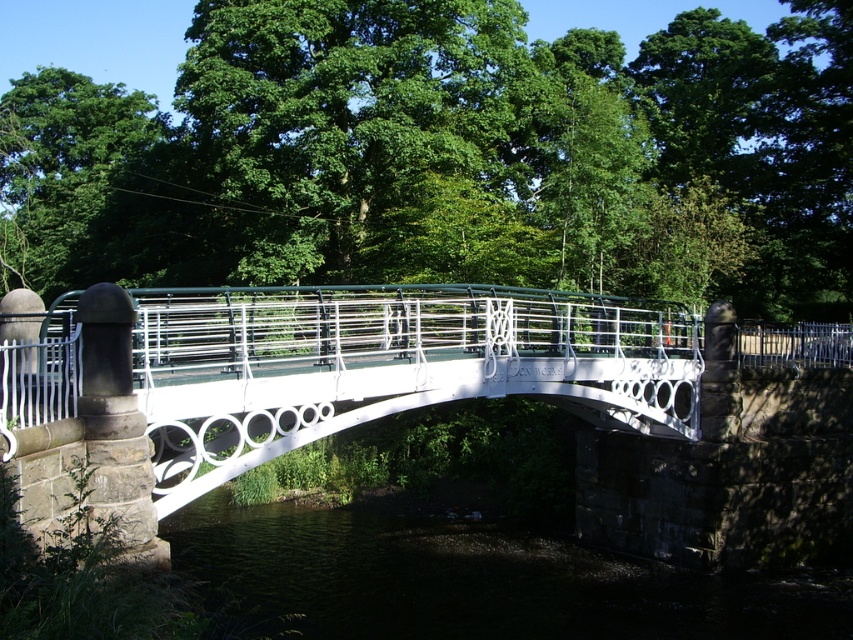
Question: Which point appears farthest from the camera in this image?

Choices:
 (A) (659, 636)
 (B) (259, 385)

Answer: (A)

Question: Which object appears closest to the camera in this image?

Choices:
 (A) dark water at lower center
 (B) white matte pedestrian bridge at center

Answer: (B)

Question: Can you confirm if white matte pedestrian bridge at center is positioned below dark water at lower center?

Choices:
 (A) no
 (B) yes

Answer: (A)

Question: Can you confirm if white matte pedestrian bridge at center is thinner than dark water at lower center?

Choices:
 (A) yes
 (B) no

Answer: (B)

Question: Which of the following is the closest to the observer?

Choices:
 (A) white matte pedestrian bridge at center
 (B) dark water at lower center

Answer: (A)

Question: Does white matte pedestrian bridge at center have a greater width compared to dark water at lower center?

Choices:
 (A) no
 (B) yes

Answer: (B)